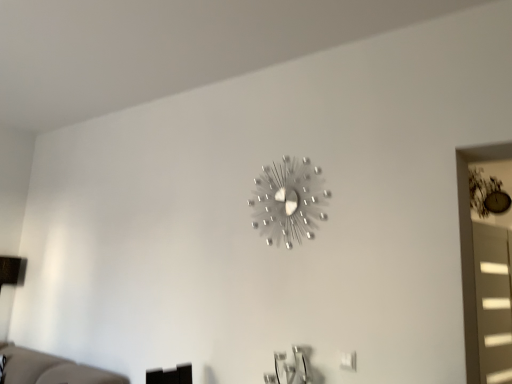
Question: From a real-world perspective, is matte gray window at right on satin silver clock at upper center?

Choices:
 (A) yes
 (B) no

Answer: (B)

Question: From the image's perspective, is matte gray window at right on satin silver clock at upper center?

Choices:
 (A) yes
 (B) no

Answer: (B)

Question: Does matte gray window at right appear on the left side of satin silver clock at upper center?

Choices:
 (A) yes
 (B) no

Answer: (B)

Question: Is matte gray window at right in front of satin silver clock at upper center?

Choices:
 (A) no
 (B) yes

Answer: (A)

Question: Can you confirm if matte gray window at right is bigger than satin silver clock at upper center?

Choices:
 (A) yes
 (B) no

Answer: (A)

Question: Is matte gray window at right surrounding satin silver clock at upper center?

Choices:
 (A) no
 (B) yes

Answer: (A)

Question: Is satin silver clock at upper center directly adjacent to matte gray window at right?

Choices:
 (A) yes
 (B) no

Answer: (B)

Question: Is satin silver clock at upper center far away from matte gray window at right?

Choices:
 (A) no
 (B) yes

Answer: (A)

Question: Is satin silver clock at upper center shorter than matte gray window at right?

Choices:
 (A) no
 (B) yes

Answer: (B)

Question: From the image's perspective, is satin silver clock at upper center over matte gray window at right?

Choices:
 (A) yes
 (B) no

Answer: (A)

Question: Does satin silver clock at upper center have a smaller size compared to matte gray window at right?

Choices:
 (A) yes
 (B) no

Answer: (A)

Question: Is satin silver clock at upper center oriented away from matte gray window at right?

Choices:
 (A) no
 (B) yes

Answer: (B)

Question: Is satin silver clock at upper center taller or shorter than matte gray window at right?

Choices:
 (A) short
 (B) tall

Answer: (A)